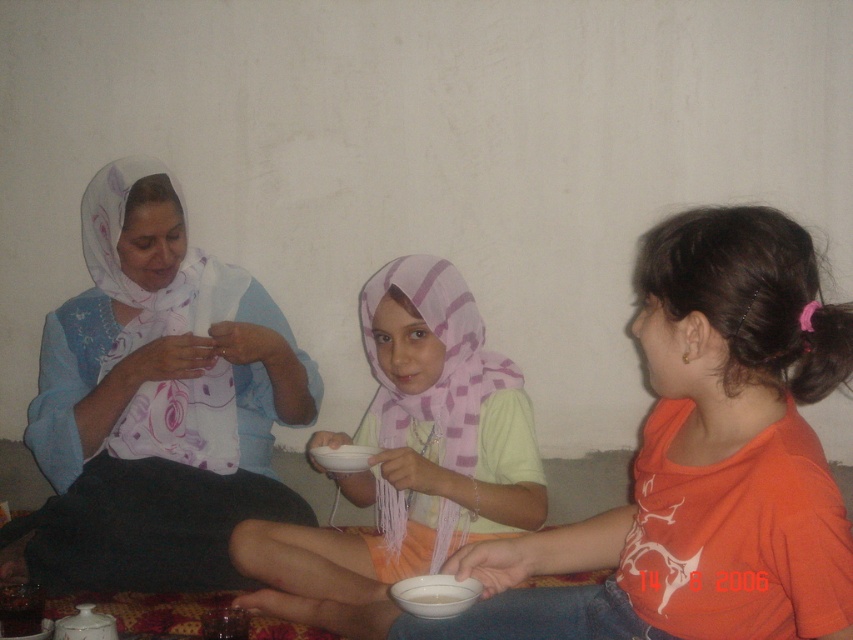
You are a photographer trying to capture a closeup of the matte pink scarf at center without the light green fabric hijab at center blocking the view. Is this possible based on their positions?

The matte pink scarf at center is in front of the light green fabric hijab at center, so it is possible to capture a closeup of the matte pink scarf at center without the light green fabric hijab at center blocking the view.

You are organizing a gift wrapping station and have two scarves to wrap. The matte pink scarf at center and the matte white scarf at left. You have a small box that can only fit items up to the size of the smaller scarf. Which scarf should you use the small box for?

The matte pink scarf at center has a smaller size compared to the matte white scarf at left, so you should use the small box for the matte pink scarf at center.